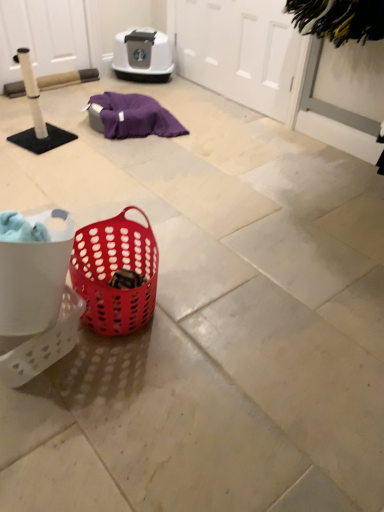
Identify the location of black fuzzy brush at upper right. The height and width of the screenshot is (512, 384). (339, 19).

The image size is (384, 512). What do you see at coordinates (339, 19) in the screenshot?
I see `black fuzzy brush at upper right` at bounding box center [339, 19].

Image resolution: width=384 pixels, height=512 pixels. I want to click on white perforated basket at lower left, so click(x=41, y=344).

What is the approximate width of matte plastic basket at center?

matte plastic basket at center is 39.03 centimeters wide.

This screenshot has height=512, width=384. What do you see at coordinates (42, 37) in the screenshot?
I see `white matte screen door at upper left, the second screen door viewed from the right` at bounding box center [42, 37].

You are a GUI agent. You are given a task and a screenshot of the screen. Output one action in this format:
    pyautogui.click(x=<x>, y=<y>)
    Task: Click on the black fuzzy brush at upper right
    
    Given the screenshot: What is the action you would take?
    point(339,19)

From a real-world perspective, which is physically above, white matte screen door at upper left, the 1th screen door in the left-to-right sequence, or white perforated basket at lower left?

white matte screen door at upper left, the 1th screen door in the left-to-right sequence.

From the image's perspective, is white matte screen door at upper left, the 1th screen door in the left-to-right sequence, located beneath white perforated basket at lower left?

No, from the image's perspective, white matte screen door at upper left, the 1th screen door in the left-to-right sequence, is not below white perforated basket at lower left.

You are a GUI agent. You are given a task and a screenshot of the screen. Output one action in this format:
    pyautogui.click(x=<x>, y=<y>)
    Task: Click on the basket located underneath the white matte screen door at upper left, the 1th screen door in the left-to-right sequence (from a real-world perspective)
    The image size is (384, 512).
    Given the screenshot: What is the action you would take?
    pyautogui.click(x=41, y=344)

Is black fuzzy brush at upper right next to white perforated basket at lower left?

They are not placed beside each other.

From the picture: Is black fuzzy brush at upper right facing towards white perforated basket at lower left?

No, black fuzzy brush at upper right does not turn towards white perforated basket at lower left.

Considering the positions of objects black fuzzy brush at upper right and white perforated basket at lower left in the image provided, who is in front, black fuzzy brush at upper right or white perforated basket at lower left?

white perforated basket at lower left is in front.

Can you confirm if black fuzzy brush at upper right is taller than white perforated basket at lower left?

Yes, black fuzzy brush at upper right is taller than white perforated basket at lower left.

Between point (210, 63) and point (18, 26), which one is positioned in front?

Positioned in front is point (18, 26).

Which of these two, white matte screen door at upper center, arranged as the 1th screen door when viewed from the right, or white matte screen door at upper left, the second screen door viewed from the right, is bigger?

white matte screen door at upper center, arranged as the 1th screen door when viewed from the right.

Considering the relative positions of white matte screen door at upper center, placed as the 2th screen door when sorted from left to right, and white matte screen door at upper left, the second screen door viewed from the right, in the image provided, is white matte screen door at upper center, placed as the 2th screen door when sorted from left to right, behind white matte screen door at upper left, the second screen door viewed from the right,?

No, white matte screen door at upper center, placed as the 2th screen door when sorted from left to right, is in front of white matte screen door at upper left, the second screen door viewed from the right.

How far apart are white matte screen door at upper center, arranged as the 1th screen door when viewed from the right, and white matte screen door at upper left, the 1th screen door in the left-to-right sequence?

4.08 feet.

You are a GUI agent. You are given a task and a screenshot of the screen. Output one action in this format:
    pyautogui.click(x=<x>, y=<y>)
    Task: Click on the screen door above the white matte screen door at upper center, placed as the 2th screen door when sorted from left to right (from the image's perspective)
    The width and height of the screenshot is (384, 512).
    Given the screenshot: What is the action you would take?
    pyautogui.click(x=42, y=37)

Could you measure the distance between white matte screen door at upper left, the 1th screen door in the left-to-right sequence, and white matte screen door at upper center, arranged as the 1th screen door when viewed from the right?

A distance of 4.08 feet exists between white matte screen door at upper left, the 1th screen door in the left-to-right sequence, and white matte screen door at upper center, arranged as the 1th screen door when viewed from the right.

Visually, is white matte screen door at upper left, the 1th screen door in the left-to-right sequence, positioned to the left or to the right of white matte screen door at upper center, placed as the 2th screen door when sorted from left to right?

white matte screen door at upper left, the 1th screen door in the left-to-right sequence, is to the left of white matte screen door at upper center, placed as the 2th screen door when sorted from left to right.

What's the angular difference between white matte screen door at upper left, the second screen door viewed from the right, and white matte screen door at upper center, arranged as the 1th screen door when viewed from the right,'s facing directions?

The angular difference between white matte screen door at upper left, the second screen door viewed from the right, and white matte screen door at upper center, arranged as the 1th screen door when viewed from the right, is 88.9 degrees.

Looking at this image, based on their sizes in the image, would you say matte plastic basket at center is bigger or smaller than white matte screen door at upper center, arranged as the 1th screen door when viewed from the right?

matte plastic basket at center is smaller than white matte screen door at upper center, arranged as the 1th screen door when viewed from the right.

Is point (144, 319) more distant than point (273, 68)?

No, (144, 319) is closer to viewer.

From a real-world perspective, between matte plastic basket at center and white matte screen door at upper center, placed as the 2th screen door when sorted from left to right, who is vertically lower?

matte plastic basket at center.

Would you say matte plastic basket at center is outside white matte screen door at upper center, arranged as the 1th screen door when viewed from the right?

A: That's correct, matte plastic basket at center is outside of white matte screen door at upper center, arranged as the 1th screen door when viewed from the right.

Image resolution: width=384 pixels, height=512 pixels. In the image, there is a black fuzzy brush at upper right. In order to click on picnic basket below it (from a real-world perspective) in this screenshot , I will do [x=113, y=273].

Is black fuzzy brush at upper right with matte plastic basket at center?

No, black fuzzy brush at upper right is not making contact with matte plastic basket at center.

Considering the sizes of black fuzzy brush at upper right and matte plastic basket at center in the image, is black fuzzy brush at upper right bigger or smaller than matte plastic basket at center?

In the image, black fuzzy brush at upper right appears to be smaller than matte plastic basket at center.

Is black fuzzy brush at upper right further to camera compared to matte plastic basket at center?

Yes, black fuzzy brush at upper right is behind matte plastic basket at center.

Is white perforated basket at lower left oriented towards matte plastic basket at center?

No, white perforated basket at lower left is not oriented towards matte plastic basket at center.

This screenshot has height=512, width=384. What are the coordinates of `picnic basket above the white perforated basket at lower left (from the image's perspective)` in the screenshot? It's located at (113, 273).

What's the angular difference between white perforated basket at lower left and matte plastic basket at center's facing directions?

The angular difference between white perforated basket at lower left and matte plastic basket at center is 32.3 degrees.

Which is more to the right, white perforated basket at lower left or matte plastic basket at center?

matte plastic basket at center.

From the image's perspective, count 2nd screen doors upward from the white perforated basket at lower left and point to it. Please provide its 2D coordinates.

[(42, 37)]

Locate an element on the screen. The width and height of the screenshot is (384, 512). clothe on the right of white perforated basket at lower left is located at coordinates (339, 19).

Which object lies nearer to the anchor point white perforated basket at lower left, white matte screen door at upper center, placed as the 2th screen door when sorted from left to right, or white matte screen door at upper left, the second screen door viewed from the right?

white matte screen door at upper center, placed as the 2th screen door when sorted from left to right.

When comparing their distances from white matte screen door at upper left, the 1th screen door in the left-to-right sequence, does black fuzzy brush at upper right or white perforated basket at lower left seem further?

white perforated basket at lower left is further to white matte screen door at upper left, the 1th screen door in the left-to-right sequence.

Which object lies further to the anchor point matte plastic basket at center, white matte screen door at upper center, placed as the 2th screen door when sorted from left to right, or black fuzzy brush at upper right?

Among the two, white matte screen door at upper center, placed as the 2th screen door when sorted from left to right, is located further to matte plastic basket at center.

Based on their spatial positions, is white matte screen door at upper center, placed as the 2th screen door when sorted from left to right, or matte plastic basket at center closer to black fuzzy brush at upper right?

Among the two, white matte screen door at upper center, placed as the 2th screen door when sorted from left to right, is located nearer to black fuzzy brush at upper right.

Considering their positions, is white matte screen door at upper center, arranged as the 1th screen door when viewed from the right, positioned further to white matte screen door at upper left, the 1th screen door in the left-to-right sequence, than matte plastic basket at center?

Based on the image, matte plastic basket at center appears to be further to white matte screen door at upper left, the 1th screen door in the left-to-right sequence.

From the image, which object appears to be nearer to black fuzzy brush at upper right, white matte screen door at upper left, the second screen door viewed from the right, or white perforated basket at lower left?

white perforated basket at lower left.

Looking at the image, which one is located closer to white perforated basket at lower left, black fuzzy brush at upper right or white matte screen door at upper left, the 1th screen door in the left-to-right sequence?

The object closer to white perforated basket at lower left is black fuzzy brush at upper right.

Looking at the image, which one is located further to white matte screen door at upper center, placed as the 2th screen door when sorted from left to right, white perforated basket at lower left or white matte screen door at upper left, the second screen door viewed from the right?

Based on the image, white perforated basket at lower left appears to be further to white matte screen door at upper center, placed as the 2th screen door when sorted from left to right.

Locate an element on the screen. The height and width of the screenshot is (512, 384). clothe between white matte screen door at upper center, placed as the 2th screen door when sorted from left to right, and matte plastic basket at center from top to bottom is located at coordinates (339, 19).

The image size is (384, 512). In order to click on picnic basket between black fuzzy brush at upper right and white perforated basket at lower left from top to bottom in this screenshot , I will do `click(113, 273)`.

Locate an element on the screen. picnic basket between white matte screen door at upper left, the second screen door viewed from the right, and black fuzzy brush at upper right is located at coordinates (113, 273).

Image resolution: width=384 pixels, height=512 pixels. Identify the location of clothe between white matte screen door at upper left, the 1th screen door in the left-to-right sequence, and white perforated basket at lower left, in the vertical direction. click(x=339, y=19).